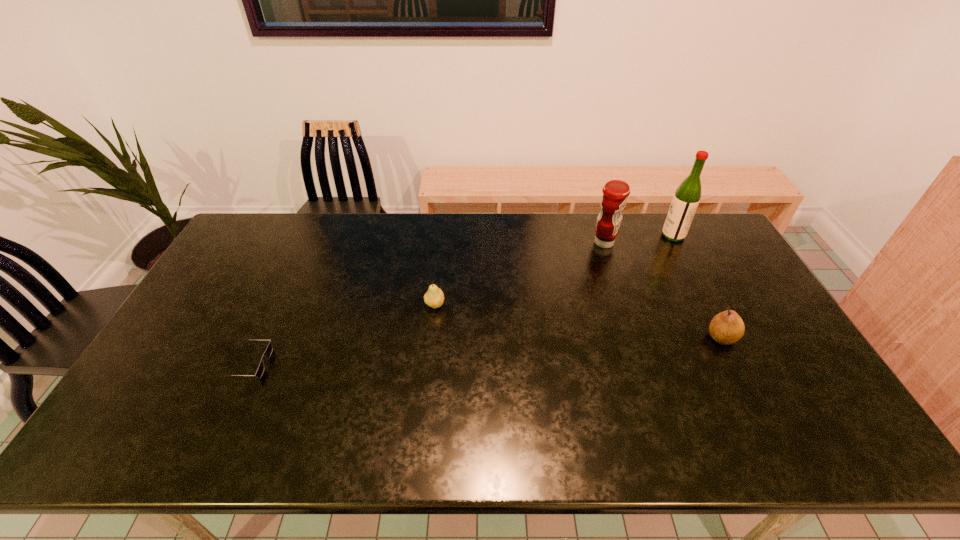
Image resolution: width=960 pixels, height=540 pixels. I want to click on object at the far right corner, so click(685, 201).

You are a GUI agent. You are given a task and a screenshot of the screen. Output one action in this format:
    pyautogui.click(x=<x>, y=<y>)
    Task: Click on the free space at the far edge
    Image resolution: width=960 pixels, height=540 pixels.
    Given the screenshot: What is the action you would take?
    pyautogui.click(x=382, y=227)

Where is `free space at the near edge of the desktop`? This screenshot has width=960, height=540. free space at the near edge of the desktop is located at coordinates (178, 453).

In the image, there is a desktop. At what (x,y) coordinates should I click in order to perform the action: click on free space at the left edge. Please return your answer as a coordinate pair (x, y). Image resolution: width=960 pixels, height=540 pixels. Looking at the image, I should click on (188, 312).

In the image, there is a desktop. Where is `vacant space at the right edge`? The image size is (960, 540). vacant space at the right edge is located at coordinates (784, 343).

Identify the location of free space at the far left corner. (267, 243).

The height and width of the screenshot is (540, 960). What are the coordinates of `vacant point at the far right corner` in the screenshot? It's located at (713, 238).

Where is `free space between the taller pear and the condiment`? free space between the taller pear and the condiment is located at coordinates (663, 290).

Identify the location of free area in between the tallest object and the taller pear. This screenshot has height=540, width=960. 698,287.

Where is `vacant area between the second shortest object and the shortest object`? vacant area between the second shortest object and the shortest object is located at coordinates (342, 334).